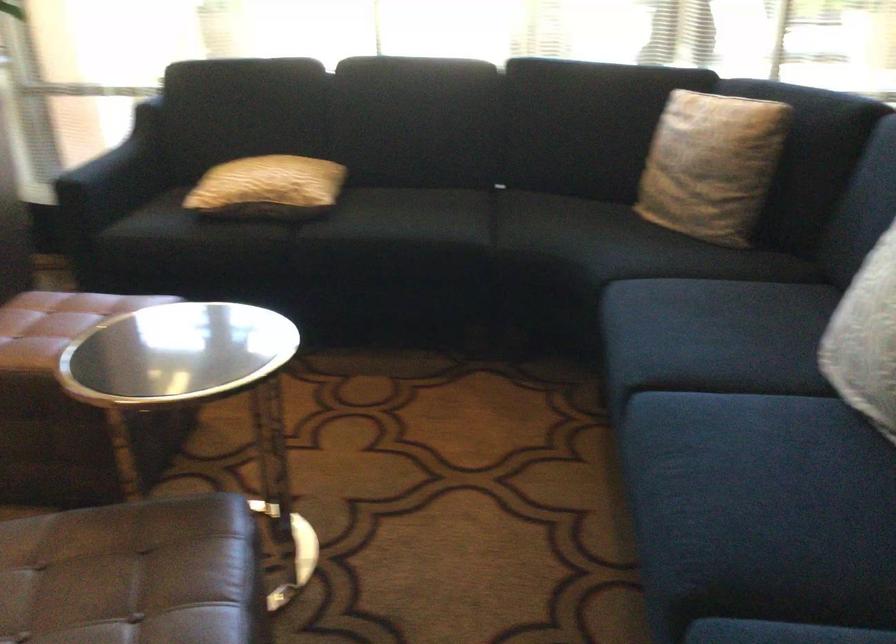
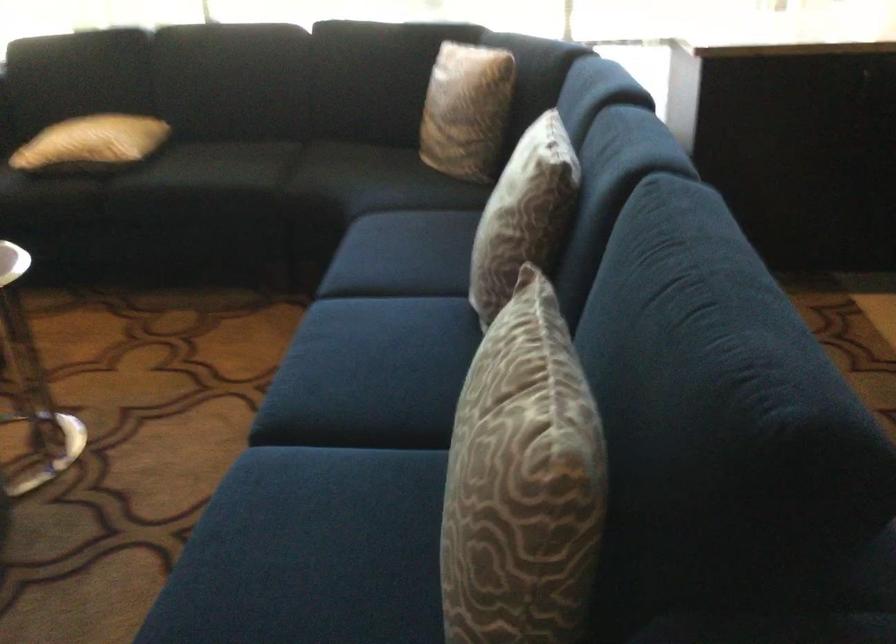
Where in the second image is the point corresponding to [280,184] from the first image?

(91, 142)